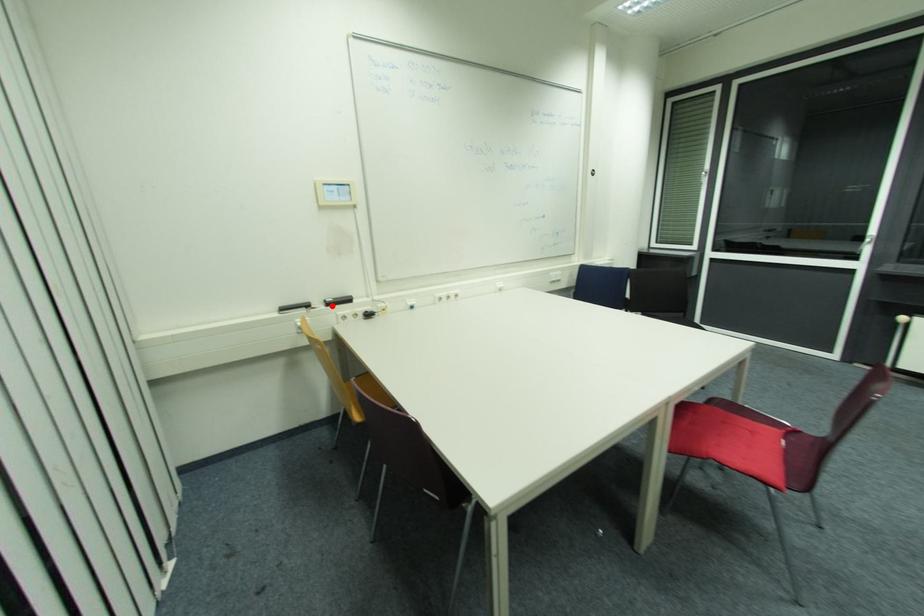
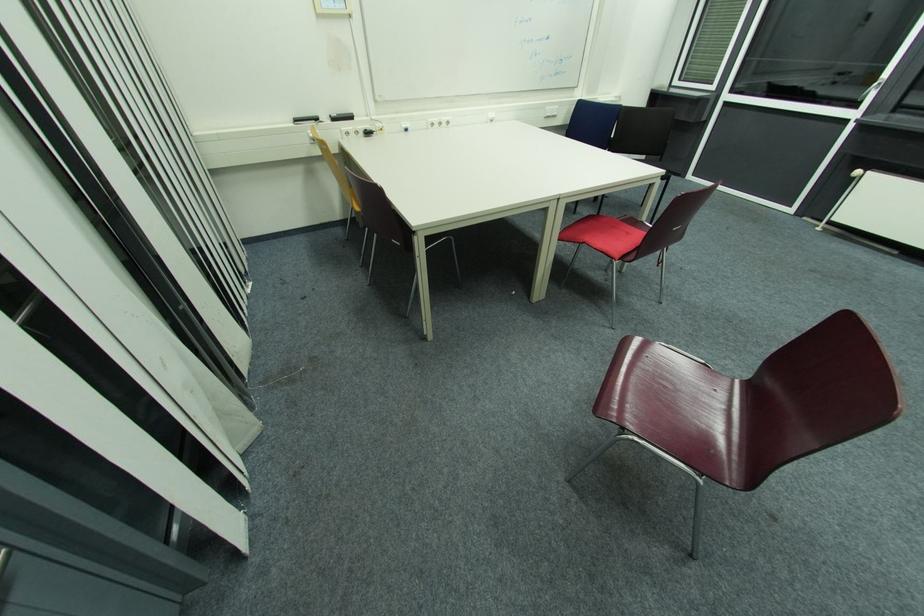
Where in the second image is the point corresponding to the highlighted location from the first image?

(337, 121)